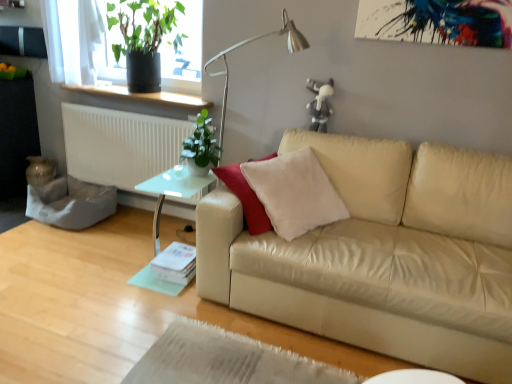
Identify the location of green glossy plant at upper left, which ranks as the first houseplant in right-to-left order. The height and width of the screenshot is (384, 512). (201, 147).

Describe the element at coordinates (382, 256) in the screenshot. Image resolution: width=512 pixels, height=384 pixels. I see `beige leather couch at center` at that location.

Locate an element on the screen. The height and width of the screenshot is (384, 512). beige leather couch at center is located at coordinates (382, 256).

Identify the location of green glossy plant at upper left, which ranks as the second houseplant in back-to-front order. The height and width of the screenshot is (384, 512). (x=201, y=147).

Is beige leather couch at center positioned behind white plastic radiator at left?

That is False.

Is beige leather couch at center shorter than white plastic radiator at left?

→ In fact, beige leather couch at center may be taller than white plastic radiator at left.

Is beige leather couch at center bigger than white plastic radiator at left?

Yes.

Between beige leather couch at center and white plastic radiator at left, which one has larger width?

beige leather couch at center is wider.

From the image's perspective, which one is positioned lower, green matte plant at upper left, the first houseplant viewed from the back, or metallic silver table lamp at upper center?

metallic silver table lamp at upper center, from the image's perspective.

Where is `table lamp that appears below the green matte plant at upper left, the first houseplant positioned from the left (from a real-world perspective)`? This screenshot has height=384, width=512. table lamp that appears below the green matte plant at upper left, the first houseplant positioned from the left (from a real-world perspective) is located at coordinates (250, 42).

Is green matte plant at upper left, placed as the 1th houseplant when sorted from top to bottom, aimed at metallic silver table lamp at upper center?

No, green matte plant at upper left, placed as the 1th houseplant when sorted from top to bottom, is not aimed at metallic silver table lamp at upper center.

Is white plastic radiator at left a part of metallic silver table lamp at upper center?

Actually, white plastic radiator at left is outside metallic silver table lamp at upper center.

How different are the orientations of metallic silver table lamp at upper center and white plastic radiator at left in degrees?

There is a 0.0255-degree angle between the facing directions of metallic silver table lamp at upper center and white plastic radiator at left.

Which object is further away from the camera, metallic silver table lamp at upper center or white plastic radiator at left?

Positioned behind is white plastic radiator at left.

Does metallic silver table lamp at upper center turn towards white plastic radiator at left?

No, metallic silver table lamp at upper center does not turn towards white plastic radiator at left.

Is point (157, 26) in front of point (191, 200)?

No, it is behind (191, 200).

Considering the sizes of objects green matte plant at upper left, which appears as the second houseplant when viewed from the front, and white plastic radiator at left in the image provided, who is shorter, green matte plant at upper left, which appears as the second houseplant when viewed from the front, or white plastic radiator at left?

Standing shorter between the two is green matte plant at upper left, which appears as the second houseplant when viewed from the front.

Considering the positions of objects green matte plant at upper left, which appears as the second houseplant when viewed from the front, and white plastic radiator at left in the image provided, who is in front, green matte plant at upper left, which appears as the second houseplant when viewed from the front, or white plastic radiator at left?

Positioned in front is green matte plant at upper left, which appears as the second houseplant when viewed from the front.

In the scene shown: Is green matte plant at upper left, the first houseplant viewed from the back, situated inside white plastic radiator at left or outside?

green matte plant at upper left, the first houseplant viewed from the back, is not enclosed by white plastic radiator at left.

Based on the photo, is green matte plant at upper left, placed as the 1th houseplant when sorted from top to bottom, to the left or to the right of transparent glass table at lower left in the image?

green matte plant at upper left, placed as the 1th houseplant when sorted from top to bottom, is to the left of transparent glass table at lower left.

Is green matte plant at upper left, placed as the 1th houseplant when sorted from top to bottom, facing away from transparent glass table at lower left?

That's not correct — green matte plant at upper left, placed as the 1th houseplant when sorted from top to bottom, is not looking away from transparent glass table at lower left.

From the image's perspective, starting from the transparent glass table at lower left, which houseplant is the 2nd one above? Please provide its 2D coordinates.

[(145, 39)]

Is the surface of green matte plant at upper left, which is counted as the second houseplant, starting from the bottom, in direct contact with transparent glass table at lower left?

green matte plant at upper left, which is counted as the second houseplant, starting from the bottom, and transparent glass table at lower left are clearly separated.

Does white plastic radiator at left appear on the right side of transparent glass table at lower left?

No, white plastic radiator at left is not to the right of transparent glass table at lower left.

Is white plastic radiator at left oriented away from transparent glass table at lower left?

white plastic radiator at left does not have its back to transparent glass table at lower left.

Is white plastic radiator at left not close to transparent glass table at lower left?

No, white plastic radiator at left is in close proximity to transparent glass table at lower left.

In the scene shown: Considering the sizes of objects metallic silver table lamp at upper center and green glossy plant at upper left, acting as the second houseplant starting from the top, in the image provided, who is thinner, metallic silver table lamp at upper center or green glossy plant at upper left, acting as the second houseplant starting from the top,?

metallic silver table lamp at upper center.

Which houseplant is the 1st one when counting from the left side of the metallic silver table lamp at upper center? Please provide its 2D coordinates.

[(201, 147)]

Is metallic silver table lamp at upper center placed right next to green glossy plant at upper left, which ranks as the first houseplant in right-to-left order?

No.

Would you say metallic silver table lamp at upper center is to the left or to the right of green glossy plant at upper left, arranged as the 1th houseplant when viewed from the front, in the picture?

In the image, metallic silver table lamp at upper center appears on the right side of green glossy plant at upper left, arranged as the 1th houseplant when viewed from the front.

At what (x,y) coordinates should I click in order to perform the action: click on studio couch below the white plastic radiator at left (from a real-world perspective). Please return your answer as a coordinate pair (x, y). The image size is (512, 384). Looking at the image, I should click on (382, 256).

At what (x,y) coordinates should I click in order to perform the action: click on table lamp below the green matte plant at upper left, placed as the 1th houseplant when sorted from top to bottom (from the image's perspective). Please return your answer as a coordinate pair (x, y). Looking at the image, I should click on (250, 42).

Estimate the real-world distances between objects in this image. Which object is closer to beige leather couch at center, transparent glass table at lower left or green matte plant at upper left, arranged as the second houseplant when viewed from the right?

Among the two, transparent glass table at lower left is located nearer to beige leather couch at center.

From the image, which object appears to be farther from green glossy plant at upper left, which ranks as the first houseplant in right-to-left order, white plastic radiator at left or beige leather couch at center?

beige leather couch at center is further to green glossy plant at upper left, which ranks as the first houseplant in right-to-left order.

Looking at the image, which one is located closer to transparent glass table at lower left, green glossy plant at upper left, acting as the second houseplant starting from the top, or metallic silver table lamp at upper center?

Based on the image, green glossy plant at upper left, acting as the second houseplant starting from the top, appears to be nearer to transparent glass table at lower left.

Considering their positions, is green glossy plant at upper left, acting as the second houseplant starting from the top, positioned closer to beige leather couch at center than metallic silver table lamp at upper center?

Among the two, green glossy plant at upper left, acting as the second houseplant starting from the top, is located nearer to beige leather couch at center.

Looking at the image, which one is located further to white plastic radiator at left, beige leather couch at center or green matte plant at upper left, arranged as the second houseplant when viewed from the right?

beige leather couch at center.

Based on their spatial positions, is green glossy plant at upper left, arranged as the 1th houseplant when viewed from the front, or beige leather couch at center further from transparent glass table at lower left?

Among the two, beige leather couch at center is located further to transparent glass table at lower left.

Looking at the image, which one is located closer to green matte plant at upper left, the first houseplant viewed from the back, green glossy plant at upper left, arranged as the 1th houseplant when ordered from the bottom, or metallic silver table lamp at upper center?

metallic silver table lamp at upper center.

Considering their positions, is white plastic radiator at left positioned closer to metallic silver table lamp at upper center than green glossy plant at upper left, acting as the second houseplant starting from the top?

Among the two, green glossy plant at upper left, acting as the second houseplant starting from the top, is located nearer to metallic silver table lamp at upper center.

Identify the location of table located between white plastic radiator at left and beige leather couch at center in the left-right direction. The image size is (512, 384). (172, 191).

In order to click on houseplant between transparent glass table at lower left and beige leather couch at center in this screenshot , I will do click(201, 147).

At what (x,y) coordinates should I click in order to perform the action: click on table lamp between transparent glass table at lower left and beige leather couch at center in the horizontal direction. Please return your answer as a coordinate pair (x, y). Looking at the image, I should click on (250, 42).

Locate an element on the screen. Image resolution: width=512 pixels, height=384 pixels. houseplant between metallic silver table lamp at upper center and transparent glass table at lower left in the up-down direction is located at coordinates (201, 147).